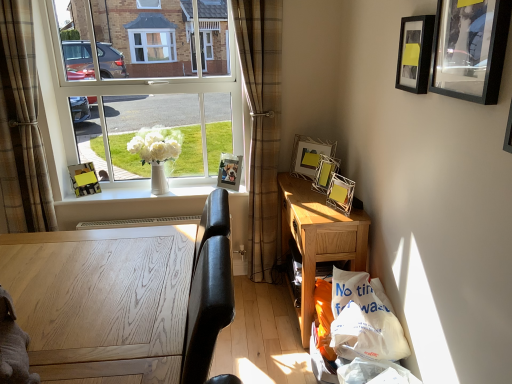
The height and width of the screenshot is (384, 512). Find the location of `vacant space behind gray plush toy at lower left`. vacant space behind gray plush toy at lower left is located at coordinates (71, 322).